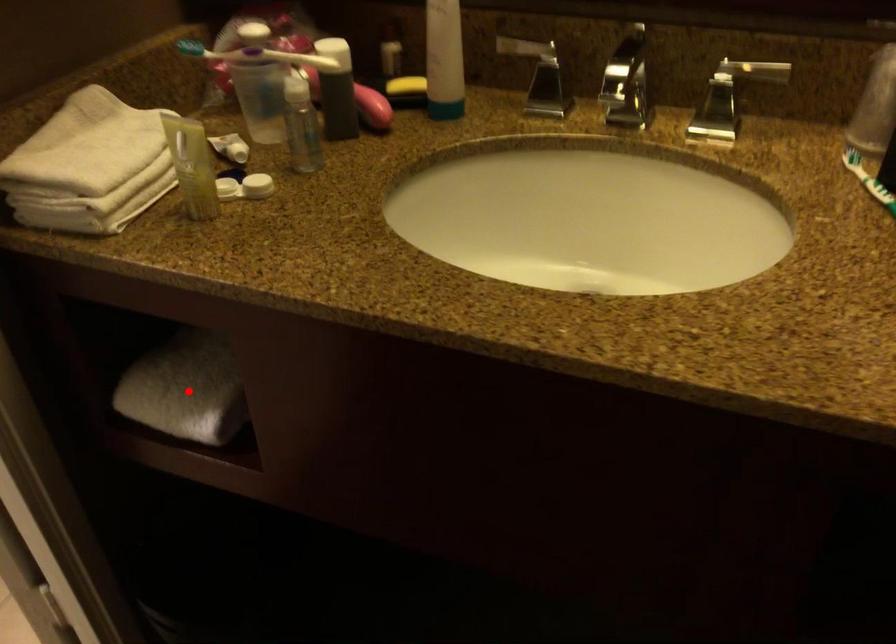
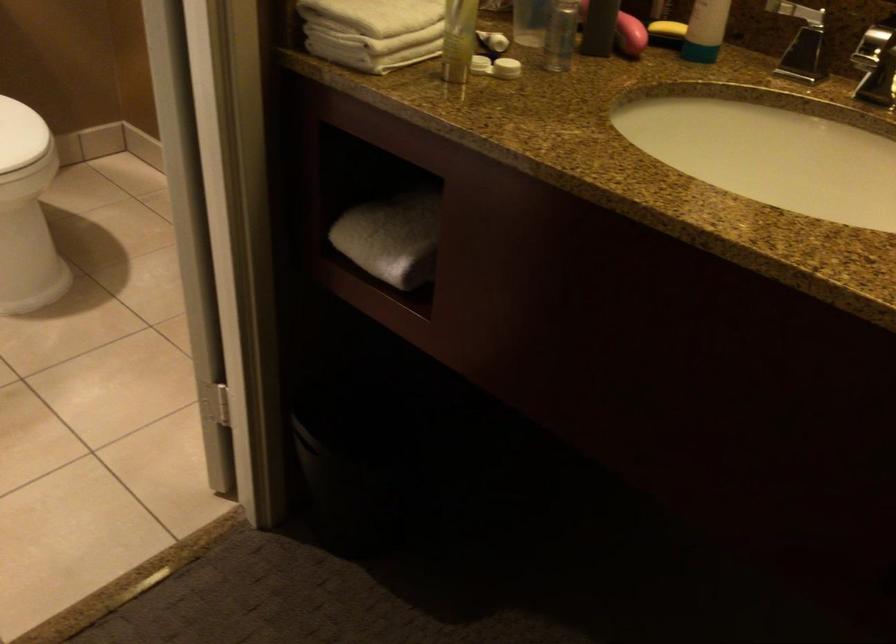
Find the pixel in the second image that matches the highlighted location in the first image.

(392, 238)